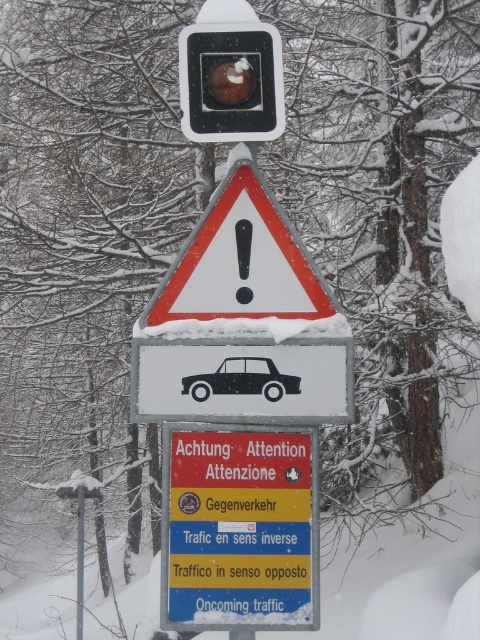
Measure the distance between point [321,285] and camera.

Point [321,285] is 11.88 feet from camera.

Is white triangular warning sign at center shorter than black matte car at center?

Incorrect, white triangular warning sign at center's height does not fall short of black matte car at center's.

Where is `white triangular warning sign at center`? This screenshot has height=640, width=480. white triangular warning sign at center is located at coordinates (240, 262).

The height and width of the screenshot is (640, 480). What are the coordinates of `red plastic sign at center` in the screenshot? It's located at (240, 528).

Is red plastic sign at center thinner than black matte car at center?

No.

Identify the location of red plastic sign at center. This screenshot has width=480, height=640. (240, 528).

Can you confirm if red plastic sign at center is positioned below white triangular warning sign at center?

Correct, red plastic sign at center is located below white triangular warning sign at center.

Does red plastic sign at center have a lesser width compared to white triangular warning sign at center?

Yes, red plastic sign at center is thinner than white triangular warning sign at center.

Describe the element at coordinates (240, 528) in the screenshot. I see `red plastic sign at center` at that location.

This screenshot has height=640, width=480. I want to click on red plastic sign at center, so click(240, 528).